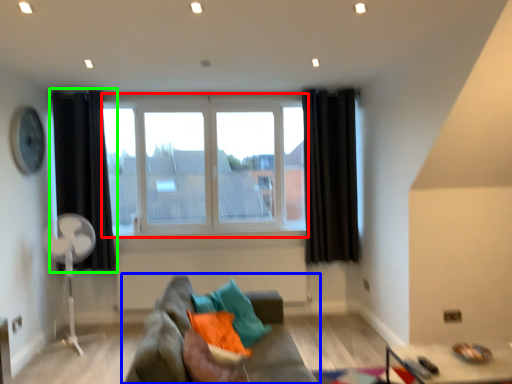
Question: Based on their relative distances, which object is nearer to window (highlighted by a red box)? Choose from studio couch (highlighted by a blue box) and curtain (highlighted by a green box).

Choices:
 (A) studio couch
 (B) curtain

Answer: (B)